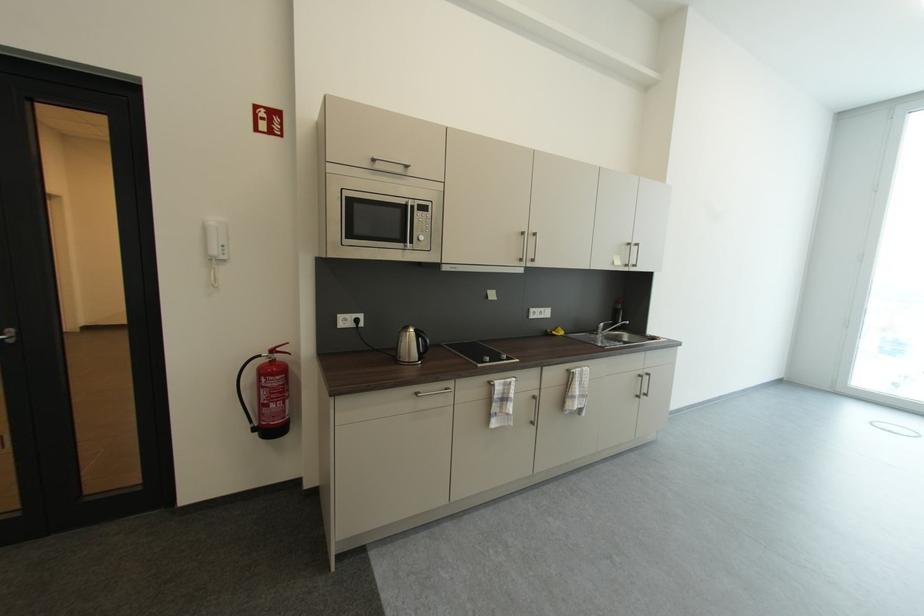
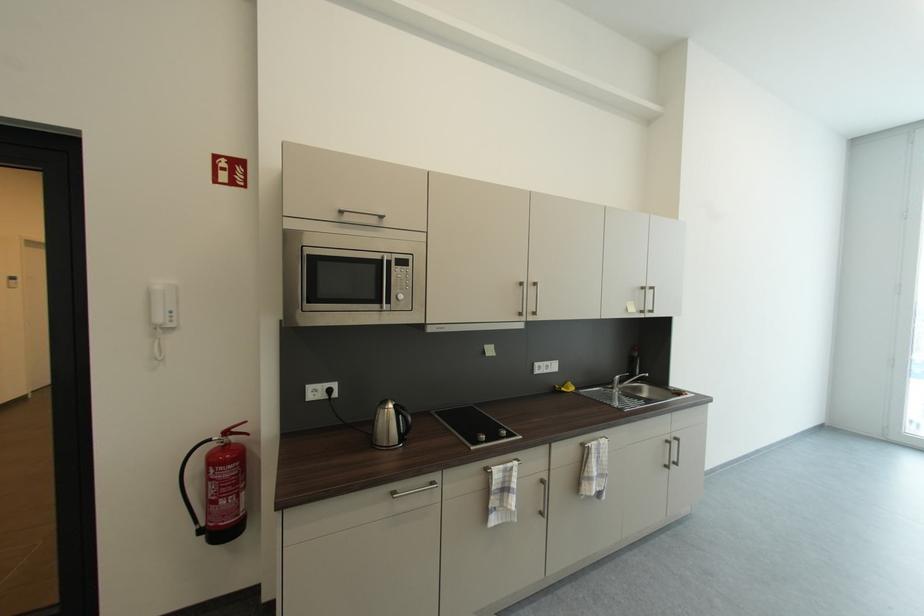
In the second image, find the point that corresponds to point (229, 252) in the first image.

(177, 318)